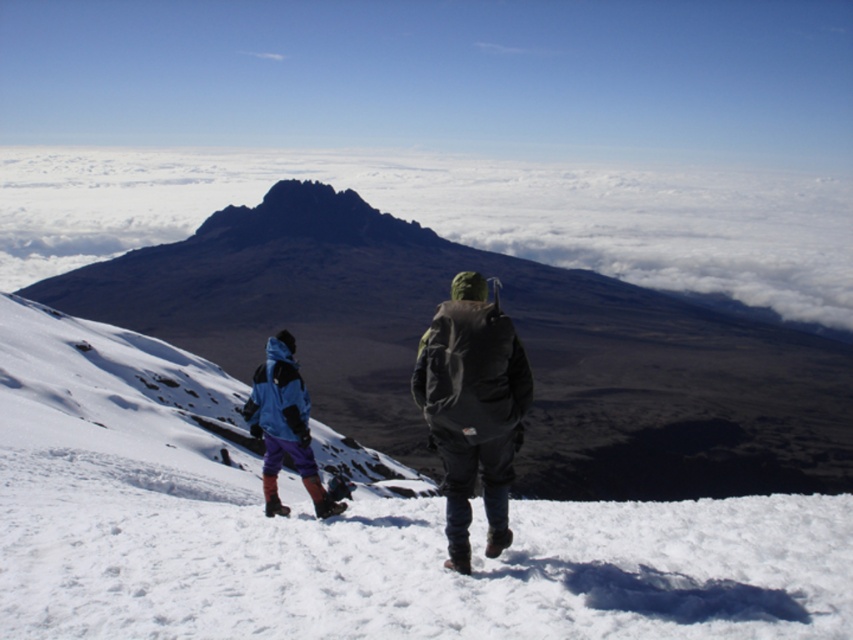
Who is positioned more to the right, dark brown rocky mountain at center or dark green waterproof jacket at center?

dark brown rocky mountain at center is more to the right.

Is dark brown rocky mountain at center smaller than dark green waterproof jacket at center?

No, dark brown rocky mountain at center is not smaller than dark green waterproof jacket at center.

Does point (311, 358) come farther from viewer compared to point (500, 328)?

Yes, point (311, 358) is farther from viewer.

This screenshot has width=853, height=640. In order to click on dark brown rocky mountain at center in this screenshot , I will do `click(518, 333)`.

Does white powdery snow at center appear over dark green waterproof jacket at center?

Actually, white powdery snow at center is below dark green waterproof jacket at center.

Looking at this image, which is more to the left, white powdery snow at center or dark green waterproof jacket at center?

Positioned to the left is white powdery snow at center.

Is point (183, 500) farther from camera compared to point (463, 536)?

That is True.

Identify the location of white powdery snow at center. The width and height of the screenshot is (853, 640). (341, 525).

In the scene shown: Who is taller, dark brown rocky mountain at center or white fluffy cloud at upper center?

With more height is white fluffy cloud at upper center.

From the picture: Does dark brown rocky mountain at center lie behind white fluffy cloud at upper center?

That is False.

Identify the location of dark brown rocky mountain at center. The height and width of the screenshot is (640, 853). (518, 333).

Find the location of `dark brown rocky mountain at center`. dark brown rocky mountain at center is located at coordinates (518, 333).